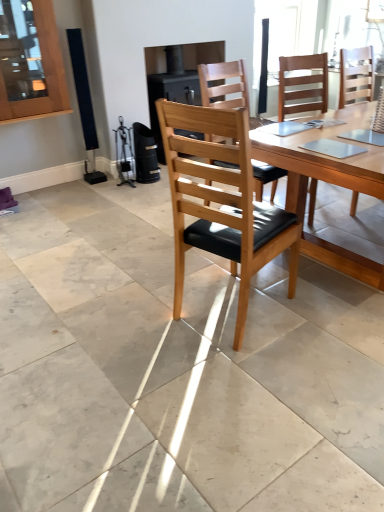
Measure the distance between point [234,275] and camera.

They are 8.30 feet apart.

Describe the element at coordinates (356, 76) in the screenshot. The image size is (384, 512). I see `wooden chair at center, which appears as the first chair when viewed from the back` at that location.

Find the location of `wooden chair at center, which appears as the first chair when viewed from the back`. wooden chair at center, which appears as the first chair when viewed from the back is located at coordinates (356, 76).

Measure the distance between light brown wood chair at center, the second chair in the front-to-back sequence, and camera.

A distance of 2.58 meters exists between light brown wood chair at center, the second chair in the front-to-back sequence, and camera.

Where is `light brown wood chair at center, marked as the second chair in a back-to-front arrangement`? light brown wood chair at center, marked as the second chair in a back-to-front arrangement is located at coordinates (223, 84).

Locate an element on the screen. wooden table at center is located at coordinates (323, 159).

From the image's perspective, is wooden chair with black cushion at center, the first chair viewed from the front, beneath light brown wood chair at center, marked as the second chair in a back-to-front arrangement?

Yes, from the image's perspective, wooden chair with black cushion at center, the first chair viewed from the front, is beneath light brown wood chair at center, marked as the second chair in a back-to-front arrangement.

Relative to light brown wood chair at center, the second chair in the front-to-back sequence, is wooden chair with black cushion at center, which is the third chair from back to front, in front or behind?

wooden chair with black cushion at center, which is the third chair from back to front, is positioned closer to the viewer than light brown wood chair at center, the second chair in the front-to-back sequence.

Find the location of a particular element. chair above the wooden chair with black cushion at center, the first chair viewed from the front (from a real-world perspective) is located at coordinates (223, 84).

Is point (349, 96) positioned before point (304, 175)?

No, (349, 96) is further to viewer.

Looking at this image, in the image, is wooden chair at center, arranged as the 3th chair when viewed from the front, positioned in front of or behind wooden table at center?

In the image, wooden chair at center, arranged as the 3th chair when viewed from the front, appears behind wooden table at center.

Is wooden chair at center, arranged as the 3th chair when viewed from the front, inside the boundaries of wooden table at center, or outside?

The correct answer is: outside.

Is wooden table at center far away from light brown wood chair at center, the second chair in the front-to-back sequence?

wooden table at center is near light brown wood chair at center, the second chair in the front-to-back sequence, not far away.

Is wooden table at center completely or partially outside of light brown wood chair at center, the second chair in the front-to-back sequence?

Yes.

Considering the positions of objects wooden table at center and light brown wood chair at center, the second chair in the front-to-back sequence, in the image provided, who is behind, wooden table at center or light brown wood chair at center, the second chair in the front-to-back sequence,?

Positioned behind is light brown wood chair at center, the second chair in the front-to-back sequence.

In terms of size, does wooden table at center appear bigger or smaller than light brown wood chair at center, marked as the second chair in a back-to-front arrangement?

Considering their sizes, wooden table at center takes up more space than light brown wood chair at center, marked as the second chair in a back-to-front arrangement.

From the image's perspective, is wooden chair with black cushion at center, which is the third chair from back to front, over wooden chair at center, arranged as the 3th chair when viewed from the front?

No, from the image's perspective, wooden chair with black cushion at center, which is the third chair from back to front, is not over wooden chair at center, arranged as the 3th chair when viewed from the front.

Could you tell me if wooden chair with black cushion at center, the first chair viewed from the front, is facing wooden chair at center, arranged as the 3th chair when viewed from the front?

Yes, wooden chair with black cushion at center, the first chair viewed from the front, is oriented towards wooden chair at center, arranged as the 3th chair when viewed from the front.

Does wooden chair with black cushion at center, the first chair viewed from the front, appear on the left side of wooden chair at center, which appears as the first chair when viewed from the back?

Yes, wooden chair with black cushion at center, the first chair viewed from the front, is to the left of wooden chair at center, which appears as the first chair when viewed from the back.

Looking at this image, could you measure the distance between wooden chair with black cushion at center, the first chair viewed from the front, and wooden chair at center, arranged as the 3th chair when viewed from the front?

The distance of wooden chair with black cushion at center, the first chair viewed from the front, from wooden chair at center, arranged as the 3th chair when viewed from the front, is 5.89 feet.

From a real-world perspective, which object stands above the other?

From a 3D spatial view, light brown wood chair at center, marked as the second chair in a back-to-front arrangement, is above.

Which object is wider, light brown wood chair at center, the second chair in the front-to-back sequence, or wooden chair at center, which appears as the first chair when viewed from the back?

With larger width is wooden chair at center, which appears as the first chair when viewed from the back.

From the image's perspective, is light brown wood chair at center, the second chair in the front-to-back sequence, on top of wooden chair at center, arranged as the 3th chair when viewed from the front?

No, from the image's perspective, light brown wood chair at center, the second chair in the front-to-back sequence, is not on top of wooden chair at center, arranged as the 3th chair when viewed from the front.

Measure the distance between light brown wood chair at center, marked as the second chair in a back-to-front arrangement, and wooden table at center.

light brown wood chair at center, marked as the second chair in a back-to-front arrangement, and wooden table at center are 26.14 inches apart from each other.

Is point (223, 70) positioned before point (362, 164)?

No, (223, 70) is behind (362, 164).

Would you say wooden table at center is part of light brown wood chair at center, marked as the second chair in a back-to-front arrangement,'s contents?

No, wooden table at center is not a part of light brown wood chair at center, marked as the second chair in a back-to-front arrangement.

Can you confirm if light brown wood chair at center, the second chair in the front-to-back sequence, is taller than wooden table at center?

Correct, light brown wood chair at center, the second chair in the front-to-back sequence, is much taller as wooden table at center.

Does wooden table at center lie in front of wooden chair at center, arranged as the 3th chair when viewed from the front?

Yes, wooden table at center is closer to the viewer.

Based on their sizes in the image, would you say wooden table at center is bigger or smaller than wooden chair at center, which appears as the first chair when viewed from the back?

Considering their sizes, wooden table at center takes up more space than wooden chair at center, which appears as the first chair when viewed from the back.

At what (x,y) coordinates should I click in order to perform the action: click on round table below the wooden chair at center, arranged as the 3th chair when viewed from the front (from a real-world perspective). Please return your answer as a coordinate pair (x, y). Image resolution: width=384 pixels, height=512 pixels. Looking at the image, I should click on (323, 159).

There is a wooden chair with black cushion at center, the first chair viewed from the front. In order to click on the 1st chair above it (from the image's perspective) in this screenshot , I will do `click(223, 84)`.

At what (x,y) coordinates should I click in order to perform the action: click on round table that appears below the wooden chair at center, arranged as the 3th chair when viewed from the front (from a real-world perspective). Please return your answer as a coordinate pair (x, y). This screenshot has width=384, height=512. Looking at the image, I should click on (323, 159).

From the image, which object appears to be nearer to wooden chair at center, arranged as the 3th chair when viewed from the front, wooden table at center or wooden chair with black cushion at center, the first chair viewed from the front?

wooden table at center lies closer to wooden chair at center, arranged as the 3th chair when viewed from the front, than the other object.

From the image, which object appears to be farther from light brown wood chair at center, marked as the second chair in a back-to-front arrangement, wooden chair at center, arranged as the 3th chair when viewed from the front, or wooden table at center?

wooden chair at center, arranged as the 3th chair when viewed from the front.

Consider the image. Estimate the real-world distances between objects in this image. Which object is closer to wooden table at center, wooden chair with black cushion at center, which is the third chair from back to front, or light brown wood chair at center, marked as the second chair in a back-to-front arrangement?

wooden chair with black cushion at center, which is the third chair from back to front, lies closer to wooden table at center than the other object.

Considering their positions, is wooden chair at center, which appears as the first chair when viewed from the back, positioned closer to wooden chair with black cushion at center, which is the third chair from back to front, than light brown wood chair at center, the second chair in the front-to-back sequence?

light brown wood chair at center, the second chair in the front-to-back sequence, is closer to wooden chair with black cushion at center, which is the third chair from back to front.

From the image, which object appears to be nearer to light brown wood chair at center, marked as the second chair in a back-to-front arrangement, wooden chair at center, arranged as the 3th chair when viewed from the front, or wooden chair with black cushion at center, the first chair viewed from the front?

wooden chair at center, arranged as the 3th chair when viewed from the front, lies closer to light brown wood chair at center, marked as the second chair in a back-to-front arrangement, than the other object.

When comparing their distances from light brown wood chair at center, marked as the second chair in a back-to-front arrangement, does wooden table at center or wooden chair at center, arranged as the 3th chair when viewed from the front, seem further?

wooden chair at center, arranged as the 3th chair when viewed from the front, lies further to light brown wood chair at center, marked as the second chair in a back-to-front arrangement, than the other object.

Based on their spatial positions, is light brown wood chair at center, marked as the second chair in a back-to-front arrangement, or wooden table at center closer to wooden chair with black cushion at center, the first chair viewed from the front?

wooden table at center is positioned closer to the anchor wooden chair with black cushion at center, the first chair viewed from the front.

From the image, which object appears to be farther from wooden chair at center, which appears as the first chair when viewed from the back, wooden chair with black cushion at center, the first chair viewed from the front, or light brown wood chair at center, marked as the second chair in a back-to-front arrangement?

Based on the image, wooden chair with black cushion at center, the first chair viewed from the front, appears to be further to wooden chair at center, which appears as the first chair when viewed from the back.

Identify the location of chair between light brown wood chair at center, marked as the second chair in a back-to-front arrangement, and wooden table at center, in the horizontal direction. (356, 76).

Identify the location of chair between wooden chair with black cushion at center, which is the third chair from back to front, and wooden chair at center, arranged as the 3th chair when viewed from the front, from front to back. The height and width of the screenshot is (512, 384). click(223, 84).

You are a GUI agent. You are given a task and a screenshot of the screen. Output one action in this format:
    pyautogui.click(x=<x>, y=<y>)
    Task: Click on the round table positioned between wooden chair with black cushion at center, which is the third chair from back to front, and wooden chair at center, which appears as the first chair when viewed from the back, from near to far
    The image size is (384, 512).
    Given the screenshot: What is the action you would take?
    pyautogui.click(x=323, y=159)